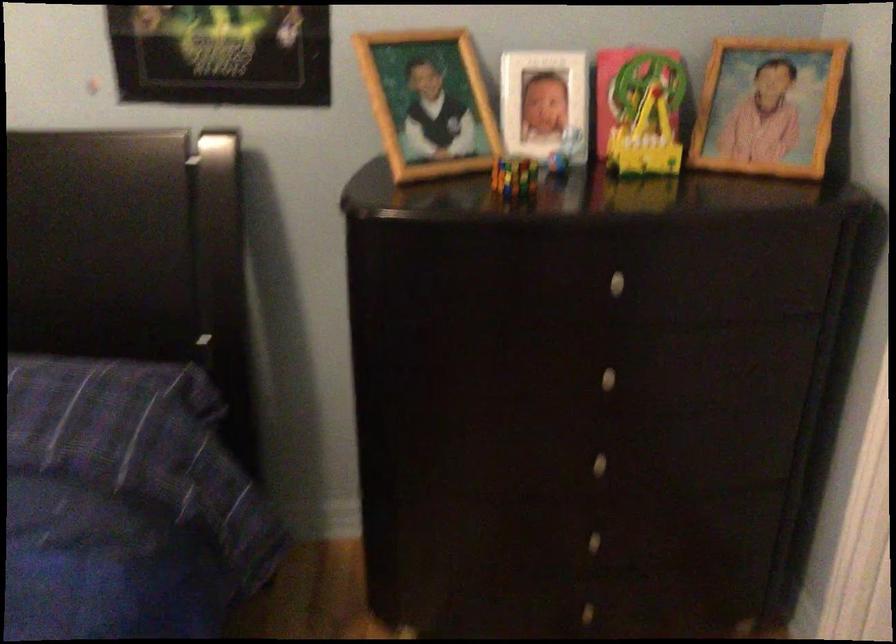
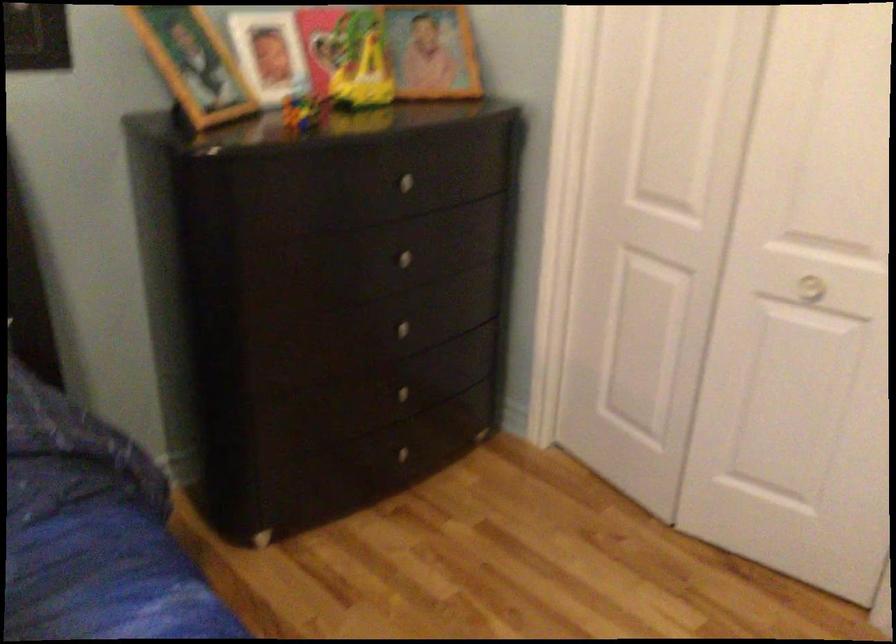
Locate, in the second image, the point that corresponds to point (607, 466) in the first image.

(409, 332)